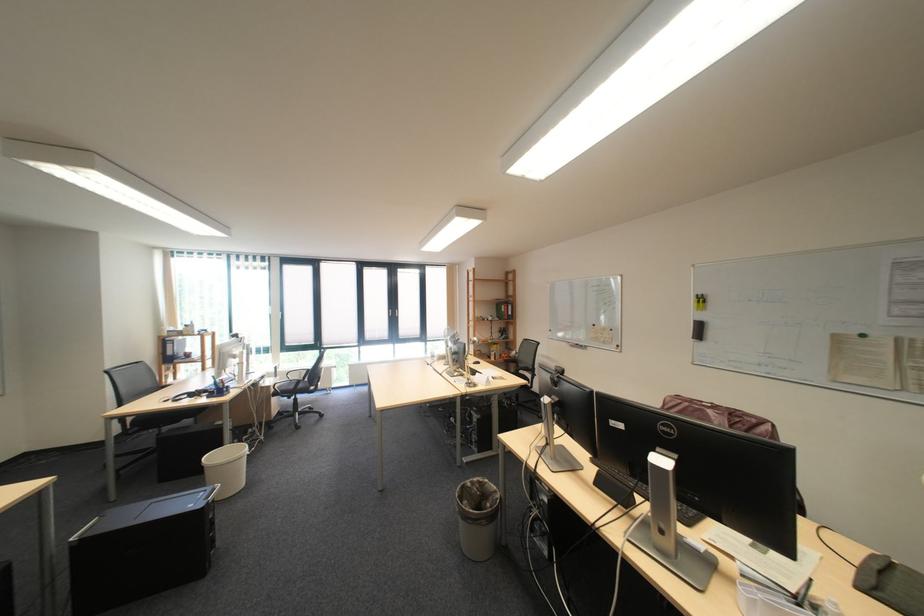
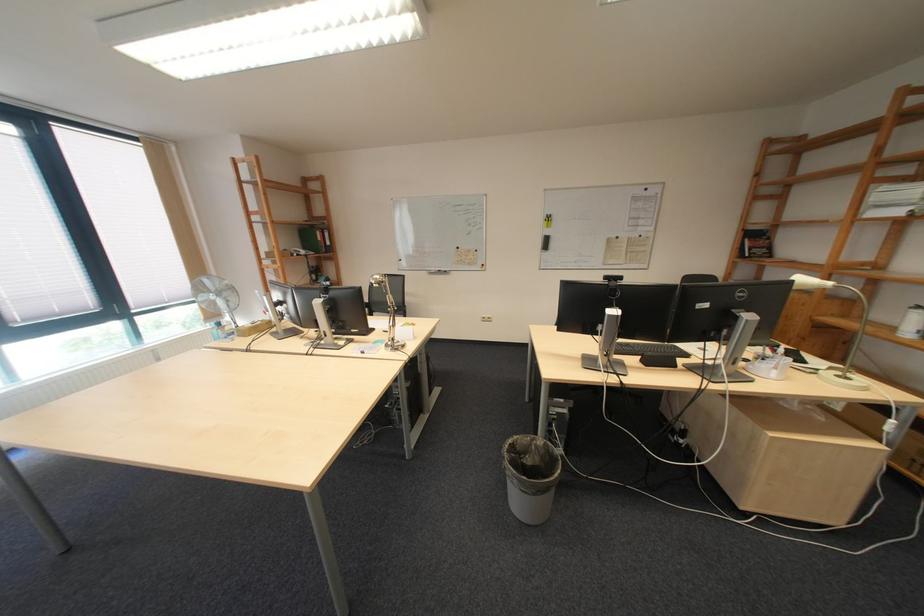
Locate, in the second image, the point that corresponds to point 501,482 in the first image.

(529, 439)